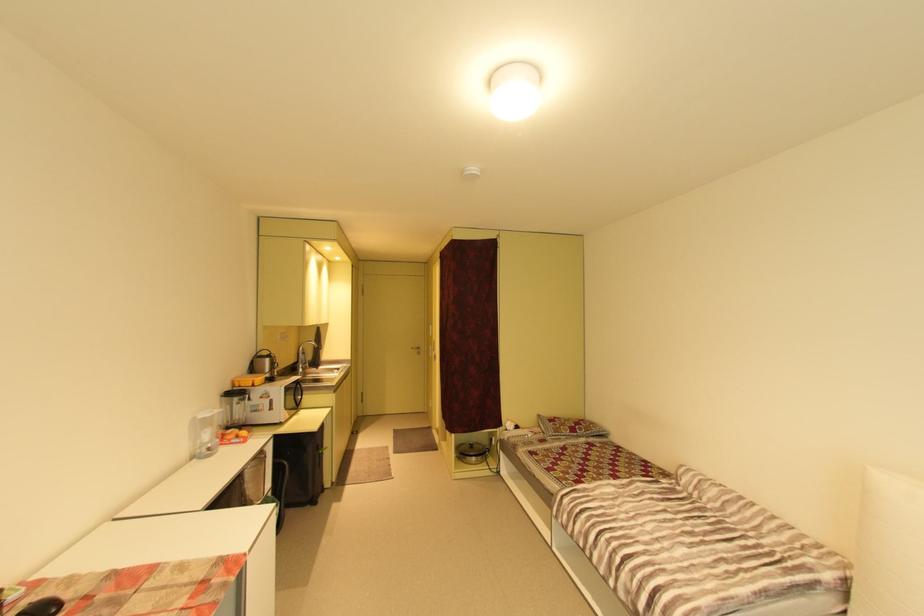
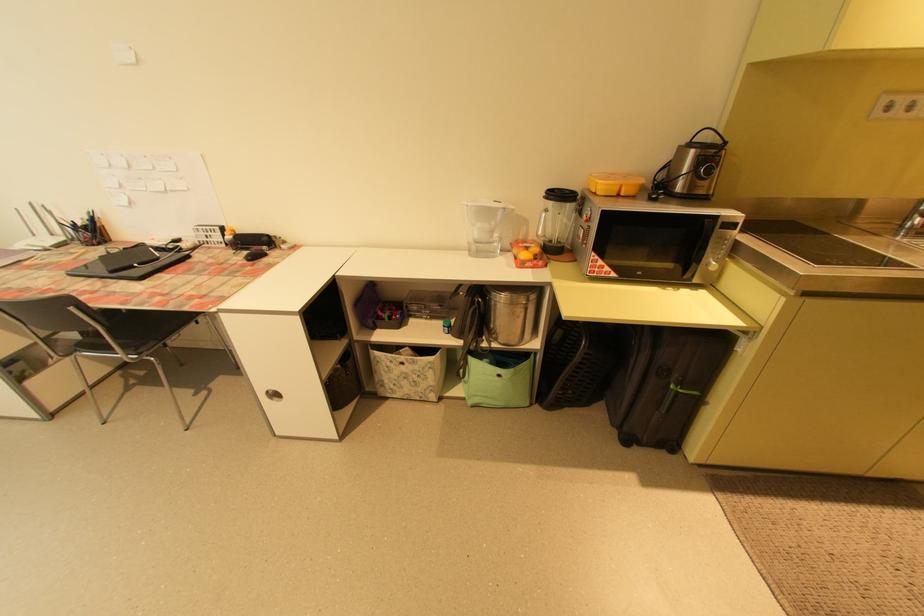
Where in the second image is the point corresponding to point (327, 453) from the first image?

(678, 387)